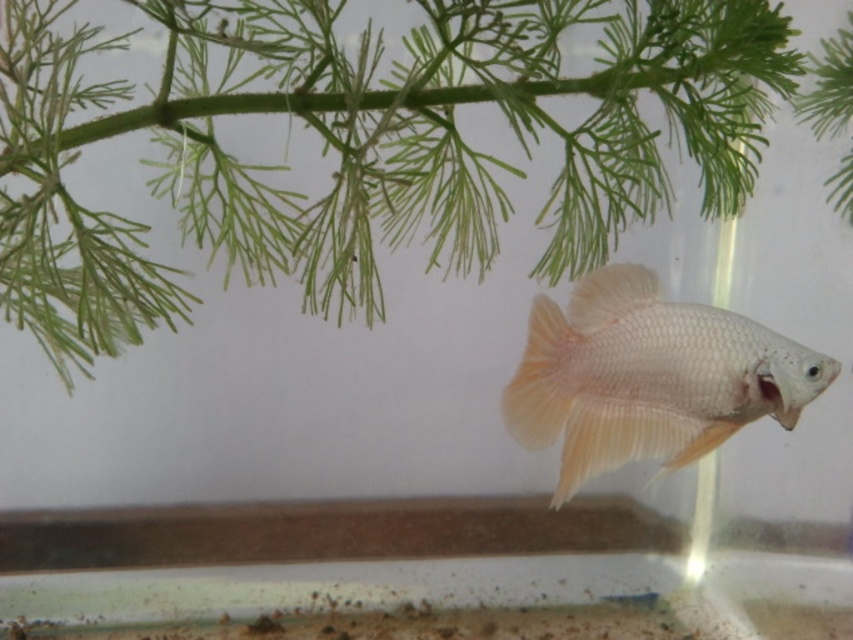
Is point (57, 4) in front of point (585, 419)?

No, (57, 4) is behind (585, 419).

I want to click on green leafy plant at upper center, so click(x=364, y=145).

Does point (318, 314) come closer to viewer compared to point (637, 358)?

No, (318, 314) is behind (637, 358).

This screenshot has height=640, width=853. I want to click on green leafy plant at upper center, so click(364, 145).